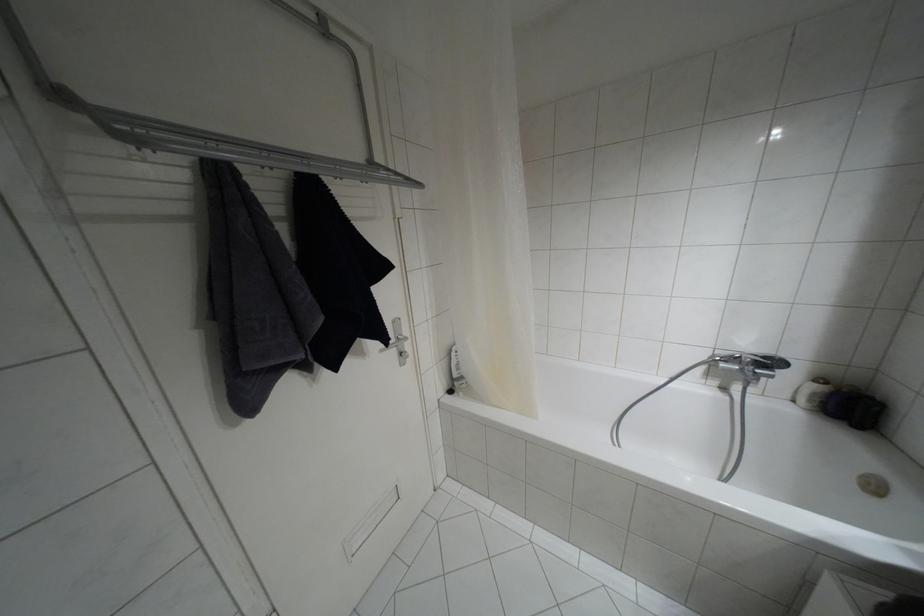
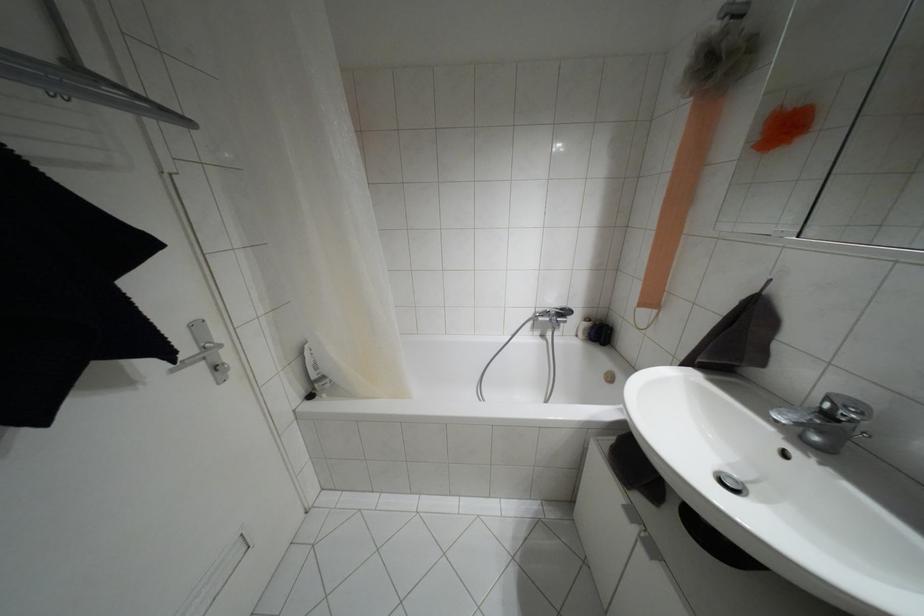
Question: Based on the continuous images, in which direction is the camera rotating? Reply with the corresponding letter.

Choices:
 (A) Left
 (B) Right
 (C) Up
 (D) Down

Answer: (B)